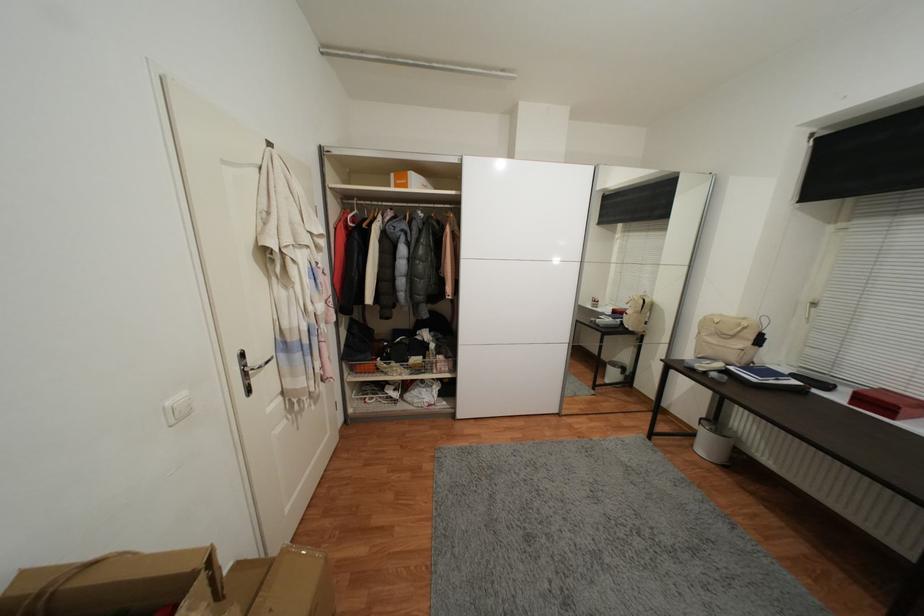
This screenshot has height=616, width=924. What do you see at coordinates (249, 370) in the screenshot? I see `a silver door handle` at bounding box center [249, 370].